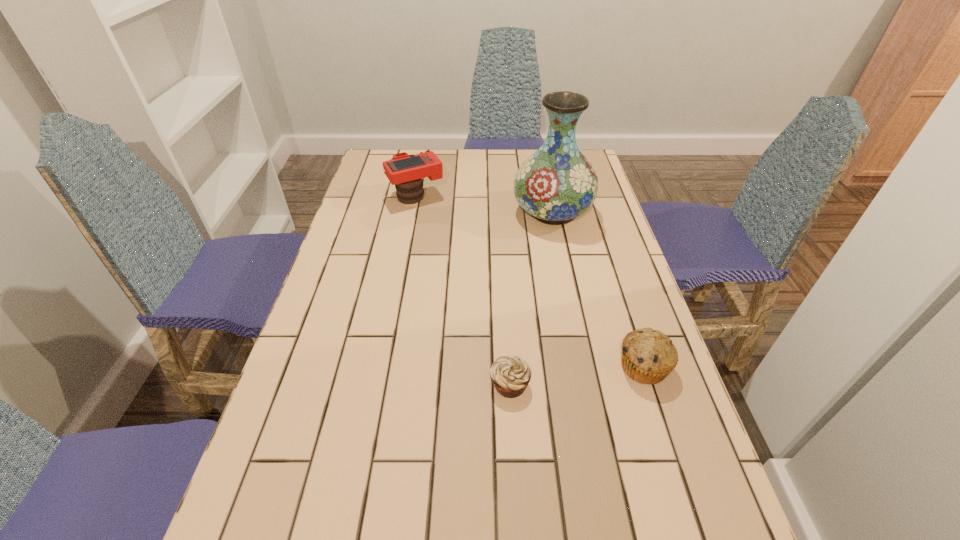
Identify the location of blank area in the image that satisfies the following two spatial constraints: 1. on the back side of the taller muffin; 2. on the right side of the left muffin. (509, 367).

Image resolution: width=960 pixels, height=540 pixels. Find the location of `vacant space that satisfies the following two spatial constraints: 1. on the front side of the third shortest object; 2. on the right side of the taller muffin`. vacant space that satisfies the following two spatial constraints: 1. on the front side of the third shortest object; 2. on the right side of the taller muffin is located at coordinates (383, 367).

Identify the location of vacant space that satisfies the following two spatial constraints: 1. on the back side of the left muffin; 2. on the left side of the vase. (500, 212).